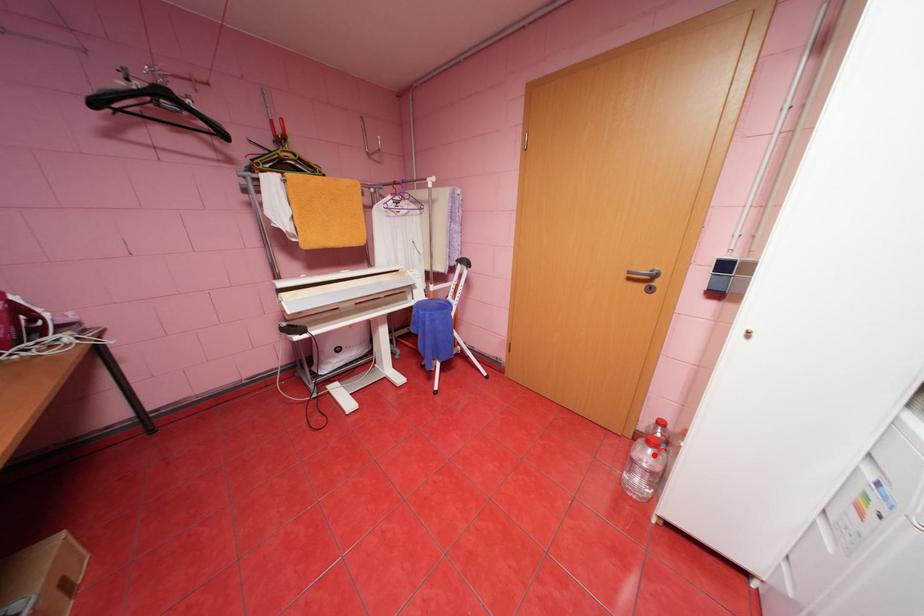
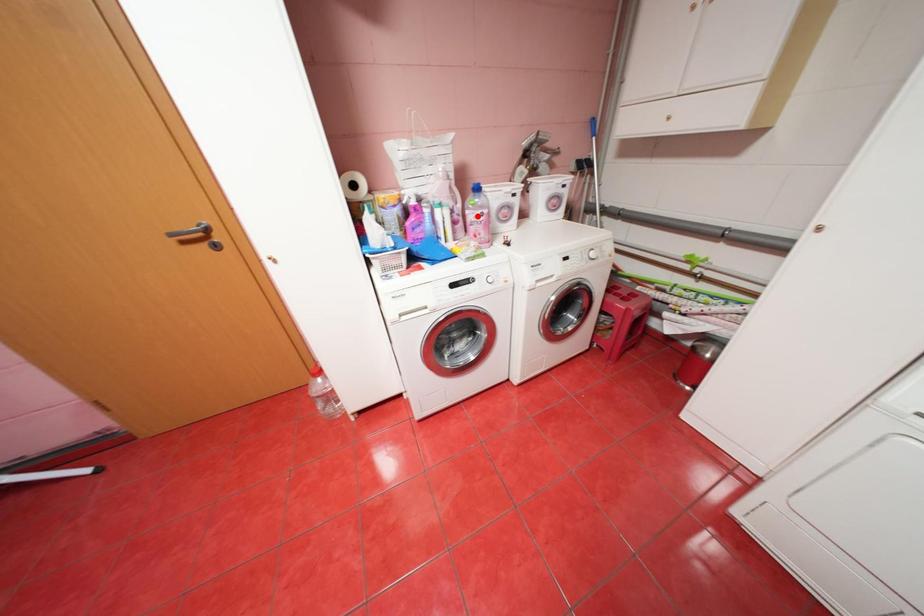
I am providing you with two images of the same scene from different viewpoints. A red point is marked on the first image and another point is marked on the second image. Is the red point in image1 aligned with the point shown in image2?

No